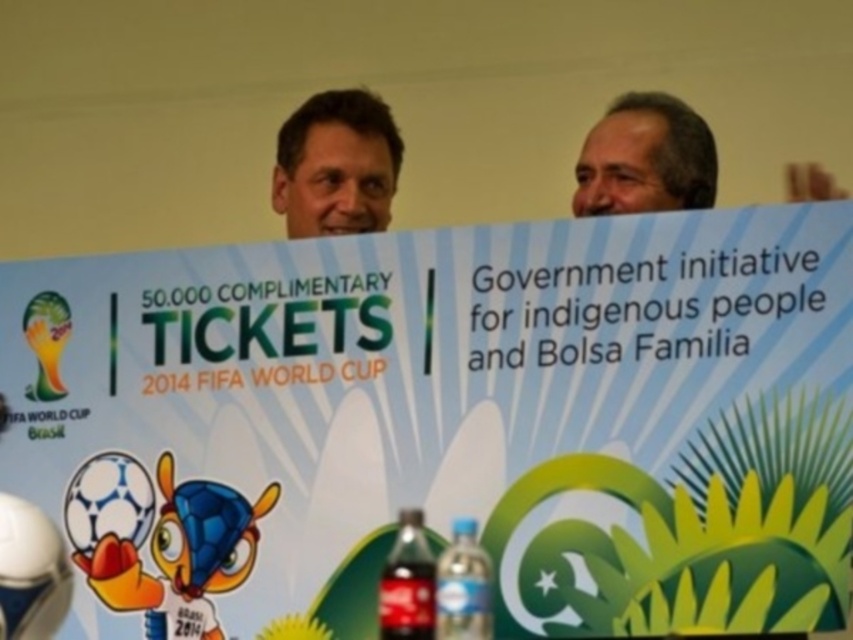
Does white paper sign at center have a lesser width compared to gray matte head at upper right?

Incorrect, white paper sign at center's width is not less than gray matte head at upper right's.

Consider the image. How far apart are white paper sign at center and gray matte head at upper right?

white paper sign at center is 36.86 inches from gray matte head at upper right.

Image resolution: width=853 pixels, height=640 pixels. I want to click on white paper sign at center, so click(x=444, y=422).

Which is more to the right, matte blue shirt at upper center or dark glass bottle at center?

dark glass bottle at center is more to the right.

Does point (300, 216) lie in front of point (405, 573)?

No, it is not.

This screenshot has height=640, width=853. Identify the location of matte blue shirt at upper center. (335, 164).

Between point (695, 208) and point (463, 536), which one is positioned in front?

Positioned in front is point (463, 536).

Based on the photo, does gray matte head at upper right come behind blue plastic bottle at lower center?

Yes, it is.

Which is in front, point (672, 205) or point (444, 586)?

Point (444, 586)

Image resolution: width=853 pixels, height=640 pixels. In order to click on gray matte head at upper right in this screenshot , I will do `click(645, 157)`.